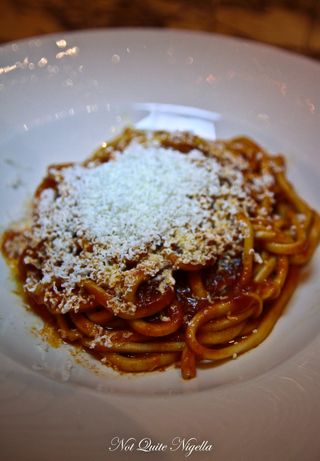
Where is `embossed design on plate`? The width and height of the screenshot is (320, 461). embossed design on plate is located at coordinates (275, 420).